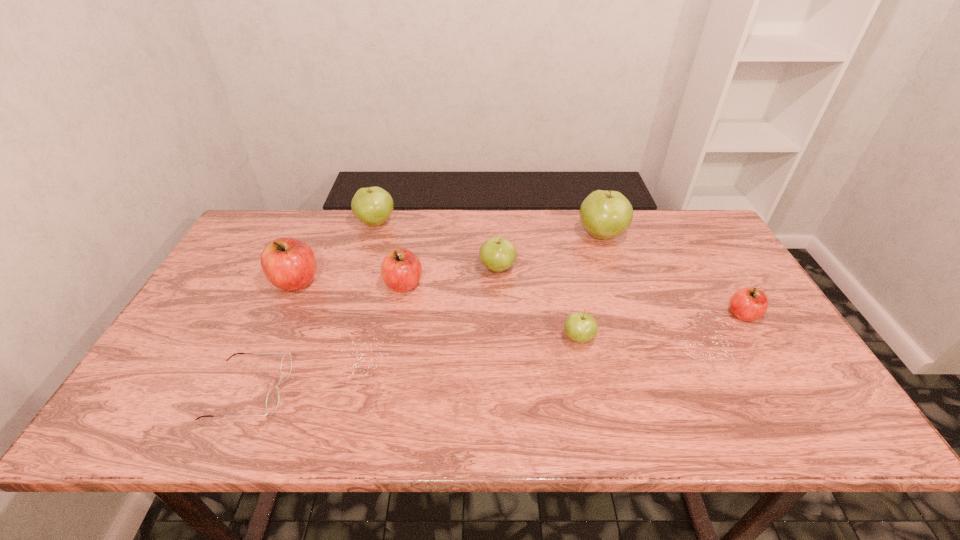
Locate an element on the screen. vacant space located on the back of the fourth object from left to right is located at coordinates (408, 260).

Locate an element on the screen. The height and width of the screenshot is (540, 960). free region located on the front of the fifth apple from left to right is located at coordinates [x=588, y=378].

This screenshot has width=960, height=540. In order to click on vacant space located on the left of the rightmost red apple in this screenshot , I will do `click(677, 314)`.

This screenshot has width=960, height=540. In order to click on vacant region located 0.280m on the front-facing side of the nearest object in this screenshot , I will do `click(410, 391)`.

Locate an element on the screen. The width and height of the screenshot is (960, 540). object present at the near edge is located at coordinates (273, 397).

Where is `apple at the left edge`? The height and width of the screenshot is (540, 960). apple at the left edge is located at coordinates (289, 264).

Identify the location of spectacles present at the left edge. The image size is (960, 540). (273, 397).

Image resolution: width=960 pixels, height=540 pixels. Identify the location of object located in the right edge section of the desktop. (748, 304).

What are the coordinates of `object located in the near left corner section of the desktop` in the screenshot? It's located at (273, 397).

In the image, there is a desktop. At what (x,y) coordinates should I click in order to perform the action: click on vacant area at the far edge. Please return your answer as a coordinate pair (x, y). Image resolution: width=960 pixels, height=540 pixels. Looking at the image, I should click on (546, 221).